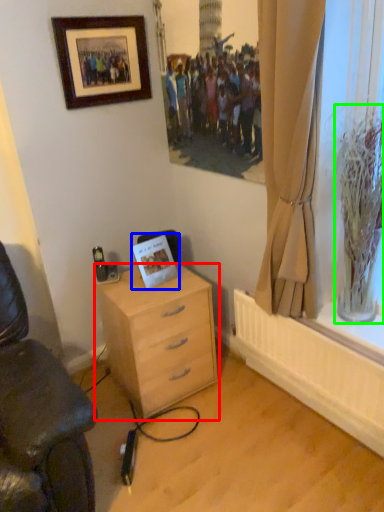
Question: Estimate the real-world distances between objects in this image. Which object is closer to desk (highlighted by a red box), postcard (highlighted by a blue box) or glass vase (highlighted by a green box)?

Choices:
 (A) postcard
 (B) glass vase

Answer: (A)